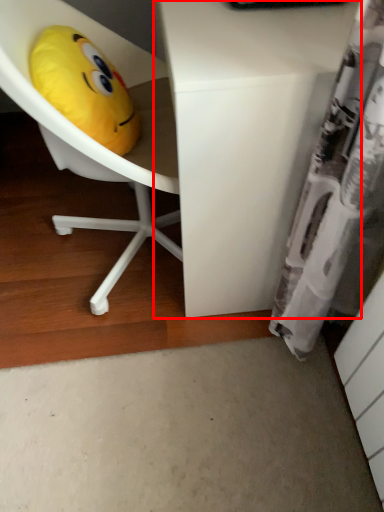
Question: From the image's perspective, where is desk (annotated by the red box) located relative to toy?

Choices:
 (A) below
 (B) above

Answer: (B)